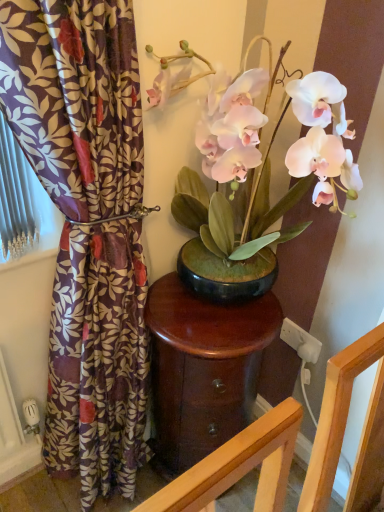
Question: Does white matte orchid at center have a lesser width compared to glossy wood table at center?

Choices:
 (A) yes
 (B) no

Answer: (B)

Question: Considering the relative positions of white matte orchid at center and glossy wood table at center in the image provided, is white matte orchid at center to the right of glossy wood table at center from the viewer's perspective?

Choices:
 (A) no
 (B) yes

Answer: (B)

Question: Is white matte orchid at center facing away from glossy wood table at center?

Choices:
 (A) yes
 (B) no

Answer: (B)

Question: Is white matte orchid at center oriented towards glossy wood table at center?

Choices:
 (A) yes
 (B) no

Answer: (B)

Question: Considering the relative sizes of white matte orchid at center and glossy wood table at center in the image provided, is white matte orchid at center smaller than glossy wood table at center?

Choices:
 (A) no
 (B) yes

Answer: (A)

Question: Is white matte orchid at center wider than glossy wood table at center?

Choices:
 (A) no
 (B) yes

Answer: (B)

Question: From the image's perspective, is glossy wood table at center located above white matte orchid at center?

Choices:
 (A) no
 (B) yes

Answer: (A)

Question: Is glossy wood table at center to the right of white matte orchid at center from the viewer's perspective?

Choices:
 (A) yes
 (B) no

Answer: (B)

Question: Does glossy wood table at center have a greater height compared to white matte orchid at center?

Choices:
 (A) no
 (B) yes

Answer: (A)

Question: Is the surface of glossy wood table at center in direct contact with white matte orchid at center?

Choices:
 (A) yes
 (B) no

Answer: (B)

Question: Can you confirm if glossy wood table at center is bigger than white matte orchid at center?

Choices:
 (A) no
 (B) yes

Answer: (A)

Question: Is glossy wood table at center facing towards white matte orchid at center?

Choices:
 (A) yes
 (B) no

Answer: (B)

Question: Is white matte orchid at center located outside purple floral fabric at left?

Choices:
 (A) yes
 (B) no

Answer: (A)